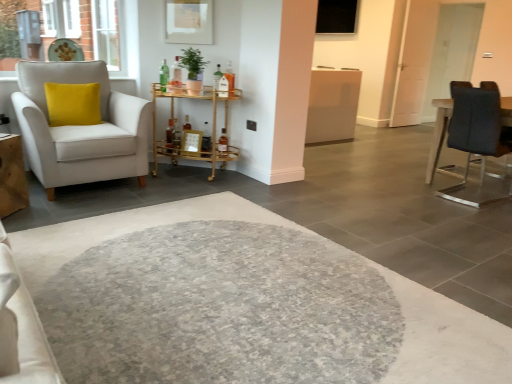
This screenshot has width=512, height=384. I want to click on gold metallic bar cart at center, the 2th table in the right-to-left sequence, so point(194,131).

What do you see at coordinates (81, 128) in the screenshot? Image resolution: width=512 pixels, height=384 pixels. I see `matte white armchair at left` at bounding box center [81, 128].

The height and width of the screenshot is (384, 512). I want to click on black glass window screen at upper center, so click(x=336, y=16).

Where is `dark wood table at right, the 2th table when ordered from left to right`? dark wood table at right, the 2th table when ordered from left to right is located at coordinates (438, 135).

Describe the element at coordinates (452, 51) in the screenshot. I see `white glossy door at upper right` at that location.

Identify the location of gold metallic bar cart at center, the 2th table in the right-to-left sequence. Image resolution: width=512 pixels, height=384 pixels. point(194,131).

From a real-world perspective, which is physically below, matte glass bottle at center or yellow velvet pillow at left?

yellow velvet pillow at left, from a real-world perspective.

The image size is (512, 384). I want to click on pillow below the matte glass bottle at center (from a real-world perspective), so 73,104.

Considering the relative sizes of matte glass bottle at center and yellow velvet pillow at left in the image provided, is matte glass bottle at center smaller than yellow velvet pillow at left?

Yes, matte glass bottle at center is smaller than yellow velvet pillow at left.

Considering the positions of objects matte glass bottle at center and yellow velvet pillow at left in the image provided, who is behind, matte glass bottle at center or yellow velvet pillow at left?

matte glass bottle at center.

Looking at their sizes, would you say matte glass bottle at center is wider or thinner than gold metallic bar cart at center, the 2th table in the right-to-left sequence?

In the image, matte glass bottle at center appears to be more narrow than gold metallic bar cart at center, the 2th table in the right-to-left sequence.

How distant is matte glass bottle at center from gold metallic bar cart at center, acting as the first table starting from the left?

The distance of matte glass bottle at center from gold metallic bar cart at center, acting as the first table starting from the left, is 19.65 inches.

Find the location of `bottle that is above the gold metallic bar cart at center, the 2th table in the right-to-left sequence (from a real-world perspective)`. bottle that is above the gold metallic bar cart at center, the 2th table in the right-to-left sequence (from a real-world perspective) is located at coordinates pos(164,75).

Can gold metallic bar cart at center, acting as the first table starting from the left, be found inside matte glass bottle at center?

No, gold metallic bar cart at center, acting as the first table starting from the left, is not surrounded by matte glass bottle at center.

Is black glass window screen at upper center not within dark wood table at right, which is the 1th table in right-to-left order?

Yes, black glass window screen at upper center is outside of dark wood table at right, which is the 1th table in right-to-left order.

Where is `table that is the 1st object directly below the black glass window screen at upper center (from a real-world perspective)`? Image resolution: width=512 pixels, height=384 pixels. table that is the 1st object directly below the black glass window screen at upper center (from a real-world perspective) is located at coordinates (438, 135).

From the image's perspective, would you say black glass window screen at upper center is positioned over dark wood table at right, which is the 1th table in right-to-left order?

Yes, from the image's perspective, black glass window screen at upper center is over dark wood table at right, which is the 1th table in right-to-left order.

What's the angular difference between black glass window screen at upper center and dark wood table at right, which is the 1th table in right-to-left order,'s facing directions?

The angular difference between black glass window screen at upper center and dark wood table at right, which is the 1th table in right-to-left order, is 179 degrees.

Considering the positions of objects black glass window screen at upper center and matte glass bottle at center in the image provided, who is more to the right, black glass window screen at upper center or matte glass bottle at center?

Positioned to the right is black glass window screen at upper center.

Considering the relative sizes of black glass window screen at upper center and matte glass bottle at center in the image provided, is black glass window screen at upper center bigger than matte glass bottle at center?

Indeed, black glass window screen at upper center has a larger size compared to matte glass bottle at center.

Is black glass window screen at upper center oriented away from matte glass bottle at center?

black glass window screen at upper center is not turned away from matte glass bottle at center.

Which is closer, (344, 30) or (165, 62)?

Clearly, point (344, 30) is more distant from the camera than point (165, 62).

Locate an element on the screen. Image resolution: width=512 pixels, height=384 pixels. chair on the right of the yellow velvet pillow at left is located at coordinates (81, 128).

In the scene shown: Would you say yellow velvet pillow at left is a long distance from matte white armchair at left?

They are positioned close to each other.

Considering the positions of objects yellow velvet pillow at left and matte white armchair at left in the image provided, who is in front, yellow velvet pillow at left or matte white armchair at left?

matte white armchair at left is more forward.

Based on the photo, could you tell me if yellow velvet pillow at left is facing matte white armchair at left?

Yes, yellow velvet pillow at left is facing matte white armchair at left.

Can you confirm if matte white armchair at left is positioned to the left of matte glass bottle at center?

Yes, matte white armchair at left is to the left of matte glass bottle at center.

Is matte white armchair at left bigger than matte glass bottle at center?

Indeed, matte white armchair at left has a larger size compared to matte glass bottle at center.

The width and height of the screenshot is (512, 384). Identify the location of chair that is in front of the matte glass bottle at center. (81, 128).

From the picture: How distant is matte white armchair at left from matte glass bottle at center?

They are 83.25 centimeters apart.

Are dark wood table at right, the 2th table when ordered from left to right, and matte glass bottle at center making contact?

No, dark wood table at right, the 2th table when ordered from left to right, is not next to matte glass bottle at center.

Between dark wood table at right, the 2th table when ordered from left to right, and matte glass bottle at center, which one appears on the right side from the viewer's perspective?

From the viewer's perspective, dark wood table at right, the 2th table when ordered from left to right, appears more on the right side.

Is point (445, 192) closer or farther from the camera than point (162, 73)?

Point (445, 192) is positioned closer to the camera compared to point (162, 73).

Measure the distance between dark wood table at right, which is the 1th table in right-to-left order, and matte glass bottle at center.

8.43 feet.

The width and height of the screenshot is (512, 384). I want to click on bottle lying above the yellow velvet pillow at left (from the image's perspective), so click(x=164, y=75).

Find the location of a particular element. This screenshot has height=384, width=512. the 1st table in front when counting from the matte glass bottle at center is located at coordinates (194, 131).

Which object lies further to the anchor point white glossy door at upper right, black glass window screen at upper center or yellow velvet pillow at left?

Based on the image, yellow velvet pillow at left appears to be further to white glossy door at upper right.

When comparing their distances from gold metallic bar cart at center, the 2th table in the right-to-left sequence, does black glass window screen at upper center or white glossy door at upper right seem further?

Among the two, white glossy door at upper right is located further to gold metallic bar cart at center, the 2th table in the right-to-left sequence.

From the image, which object appears to be nearer to black glass window screen at upper center, gold metallic bar cart at center, acting as the first table starting from the left, or white glossy door at upper right?

white glossy door at upper right is positioned closer to the anchor black glass window screen at upper center.

Considering their positions, is gold metallic bar cart at center, acting as the first table starting from the left, positioned closer to matte glass bottle at center than dark wood table at right, the 2th table when ordered from left to right?

gold metallic bar cart at center, acting as the first table starting from the left.

From the image, which object appears to be farther from dark wood table at right, which is the 1th table in right-to-left order, yellow velvet pillow at left or brick wall at upper left?

The object further to dark wood table at right, which is the 1th table in right-to-left order, is brick wall at upper left.

Which object lies further to the anchor point white glossy door at upper right, brick wall at upper left or yellow velvet pillow at left?

yellow velvet pillow at left lies further to white glossy door at upper right than the other object.

Looking at the image, which one is located closer to matte white armchair at left, dark wood table at right, the 2th table when ordered from left to right, or black glass window screen at upper center?

dark wood table at right, the 2th table when ordered from left to right, is closer to matte white armchair at left.

Which object lies further to the anchor point dark wood table at right, the 2th table when ordered from left to right, gold metallic bar cart at center, the 2th table in the right-to-left sequence, or brick wall at upper left?

brick wall at upper left is further to dark wood table at right, the 2th table when ordered from left to right.

The width and height of the screenshot is (512, 384). I want to click on pillow located between matte white armchair at left and matte glass bottle at center in the depth direction, so click(x=73, y=104).

Identify the location of bottle located between matte white armchair at left and dark wood table at right, the 2th table when ordered from left to right, in the left-right direction. The image size is (512, 384). (164, 75).

Identify the location of chair between yellow velvet pillow at left and gold metallic bar cart at center, acting as the first table starting from the left, in the horizontal direction. (81, 128).

Find the location of a particular element. table between dark wood table at right, which is the 1th table in right-to-left order, and black glass window screen at upper center from front to back is located at coordinates (194, 131).